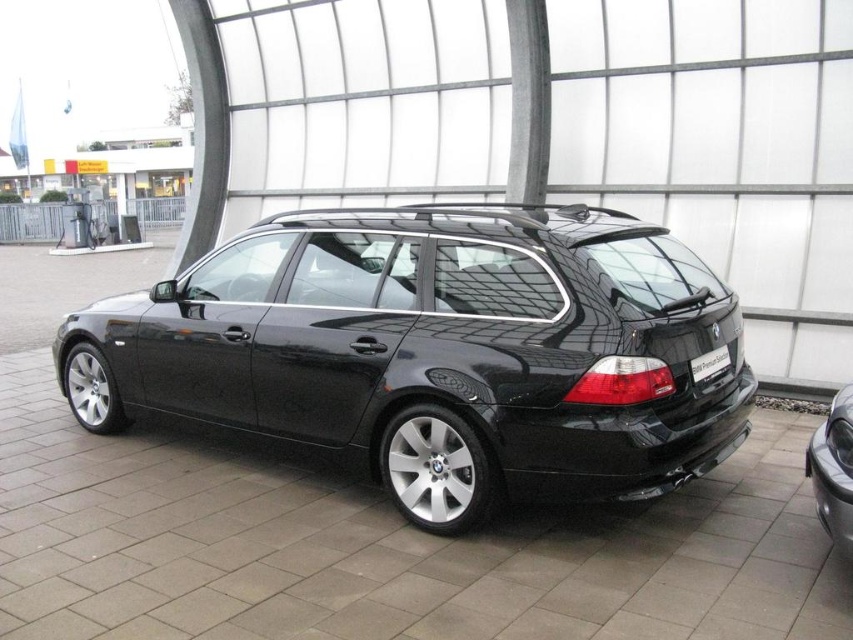
This screenshot has height=640, width=853. Describe the element at coordinates (437, 349) in the screenshot. I see `glossy black car at center` at that location.

Does glossy black car at center have a smaller size compared to black plastic license plate at rear?

Incorrect, glossy black car at center is not smaller in size than black plastic license plate at rear.

Where is `glossy black car at center`? glossy black car at center is located at coordinates (437, 349).

Does satin black car at lower right appear under black plastic license plate at rear?

Yes.

Which of these two, satin black car at lower right or black plastic license plate at rear, stands shorter?

black plastic license plate at rear is shorter.

Between point (827, 417) and point (694, 365), which one is positioned in front?

Point (694, 365) is in front.

The image size is (853, 640). I want to click on satin black car at lower right, so pyautogui.click(x=833, y=470).

Consider the image. Is glossy black car at center wider than satin black car at lower right?

Yes, glossy black car at center is wider than satin black car at lower right.

Describe the element at coordinates (437, 349) in the screenshot. I see `glossy black car at center` at that location.

Image resolution: width=853 pixels, height=640 pixels. Identify the location of glossy black car at center. (437, 349).